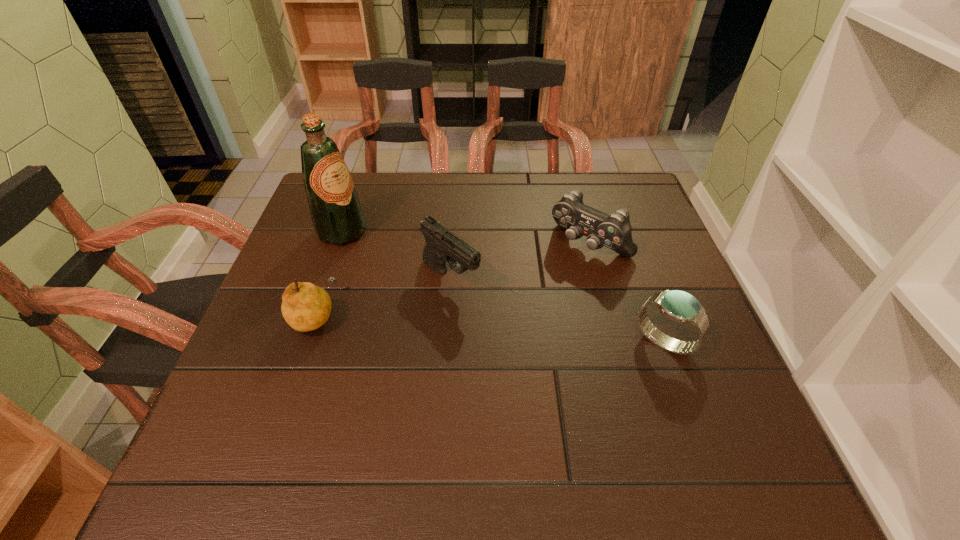
This screenshot has width=960, height=540. In order to click on free space on the desktop that is between the pear and the watch and is positioned on the front-facing side of the tallest object in this screenshot , I will do `click(518, 331)`.

The image size is (960, 540). I want to click on vacant space on the desktop that is between the pear and the watch and is positioned on the surface of the control with buttons, so click(505, 330).

Find the location of `vacant space on the desktop that is between the pear and the watch and is positioned at the barrel of the third object from left to right`. vacant space on the desktop that is between the pear and the watch and is positioned at the barrel of the third object from left to right is located at coordinates (514, 330).